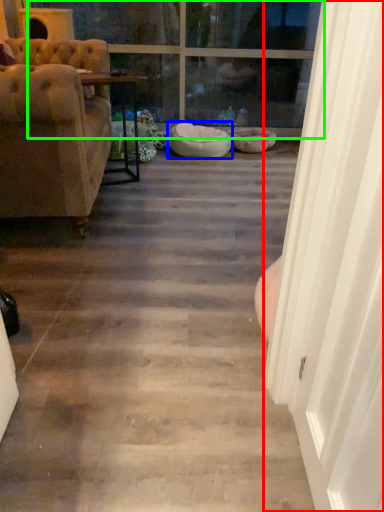
Question: Based on their relative distances, which object is farther from screen door (highlighted by a red box)? Choose from dog bed (highlighted by a blue box) and window (highlighted by a green box).

Choices:
 (A) dog bed
 (B) window

Answer: (B)